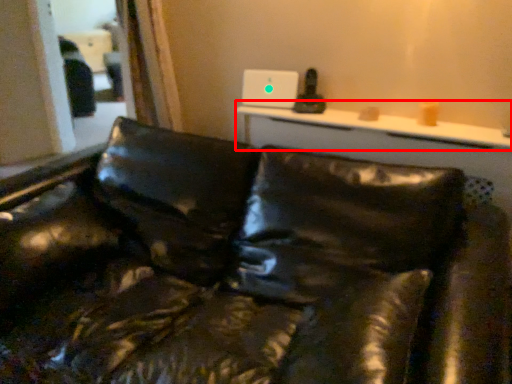
Question: Considering the relative positions of table (annotated by the red box) and studio couch in the image provided, where is table (annotated by the red box) located with respect to the staircase?

Choices:
 (A) left
 (B) right

Answer: (B)